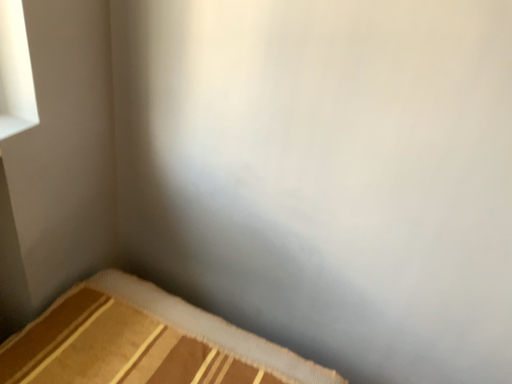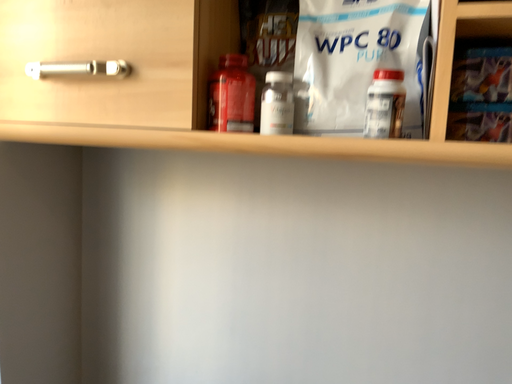
Question: How did the camera likely rotate when shooting the video?

Choices:
 (A) rotated downward
 (B) rotated upward

Answer: (B)